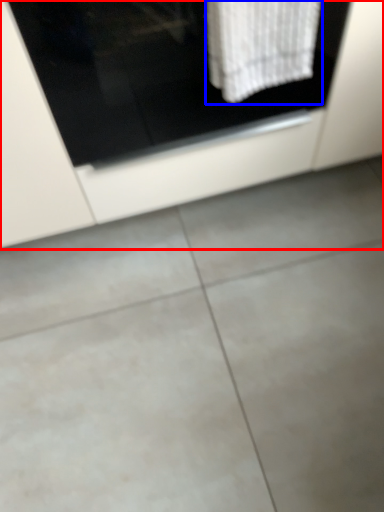
Question: Among these objects, which one is farthest to the camera, cabinetry (highlighted by a red box) or bath towel (highlighted by a blue box)?

Choices:
 (A) cabinetry
 (B) bath towel

Answer: (A)